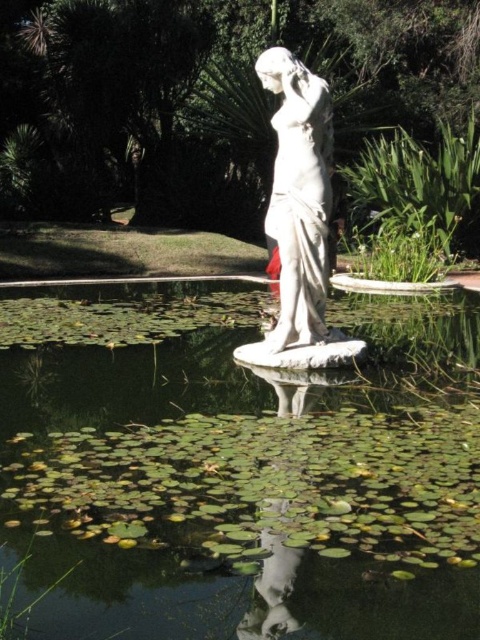
Question: Which point appears farthest from the camera in this image?

Choices:
 (A) (311, 269)
 (B) (398, 634)

Answer: (A)

Question: Can you confirm if green lily pads at center is positioned above white marble statue at center?

Choices:
 (A) no
 (B) yes

Answer: (A)

Question: Does green lily pads at center appear over white marble statue at center?

Choices:
 (A) no
 (B) yes

Answer: (A)

Question: Does green lily pads at center have a smaller size compared to white marble statue at center?

Choices:
 (A) no
 (B) yes

Answer: (B)

Question: Which point is farther from the camera taking this photo?

Choices:
 (A) click(x=422, y=508)
 (B) click(x=299, y=248)

Answer: (B)